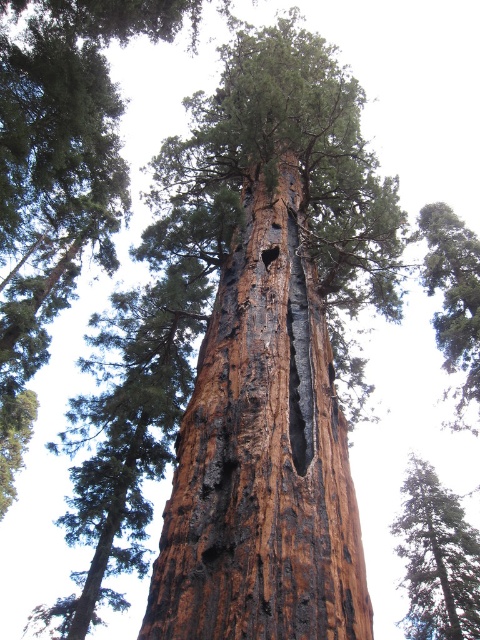
Question: Which object appears farthest from the camera in this image?

Choices:
 (A) rough bark tree at upper center
 (B) dark brown wood hole at center
 (C) rough bark tree at center
 (D) charred bark tree trunk at center

Answer: (C)

Question: Which object appears closest to the camera in this image?

Choices:
 (A) rough bark tree at center
 (B) dark brown wood hole at center

Answer: (B)

Question: Which point is closer to the camera?

Choices:
 (A) rough bark tree at center
 (B) rough bark tree at upper center
 (C) dark brown wood hole at center
 (D) charred bark tree trunk at center

Answer: (D)

Question: Is rough bark tree at center in front of rough bark tree at upper center?

Choices:
 (A) yes
 (B) no

Answer: (B)

Question: Does charred bark tree trunk at center appear on the left side of rough bark tree at upper center?

Choices:
 (A) yes
 (B) no

Answer: (A)

Question: In this image, where is rough bark tree at upper center located relative to dark brown wood hole at center?

Choices:
 (A) above
 (B) below

Answer: (B)